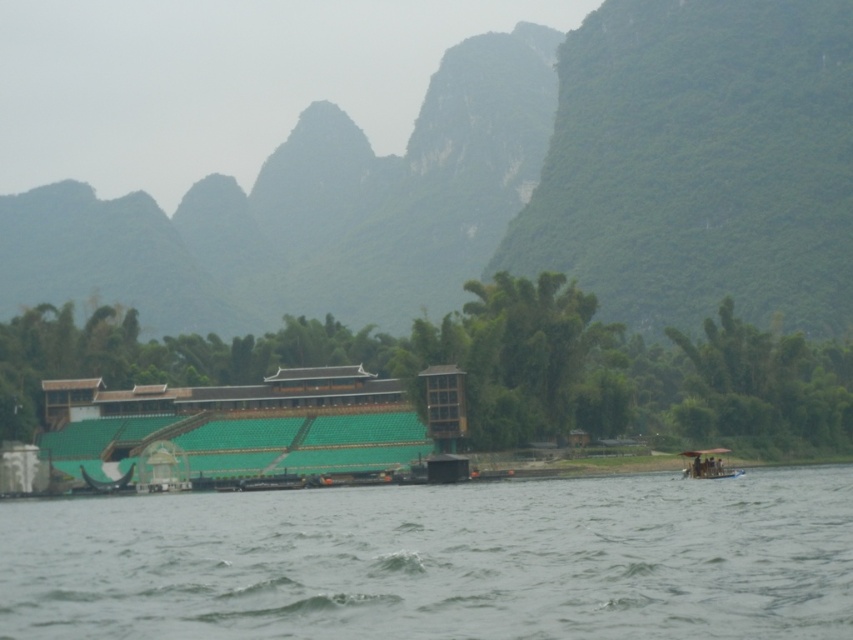
Is point (717, 170) closer to viewer compared to point (107, 484)?

No, it is not.

I want to click on green textured mountain at upper center, so click(x=511, y=188).

Can you confirm if green textured mountain at upper center is bigger than green leafy mountain at upper right?

Answer: Correct, green textured mountain at upper center is larger in size than green leafy mountain at upper right.

Where is `green textured mountain at upper center`? The width and height of the screenshot is (853, 640). green textured mountain at upper center is located at coordinates (511, 188).

Who is positioned more to the right, green textured mountain at upper center or wooden boat at lower right?

Positioned to the right is wooden boat at lower right.

Which of these two, green textured mountain at upper center or wooden boat at lower right, stands taller?

Standing taller between the two is green textured mountain at upper center.

Where is `green textured mountain at upper center`? green textured mountain at upper center is located at coordinates (511, 188).